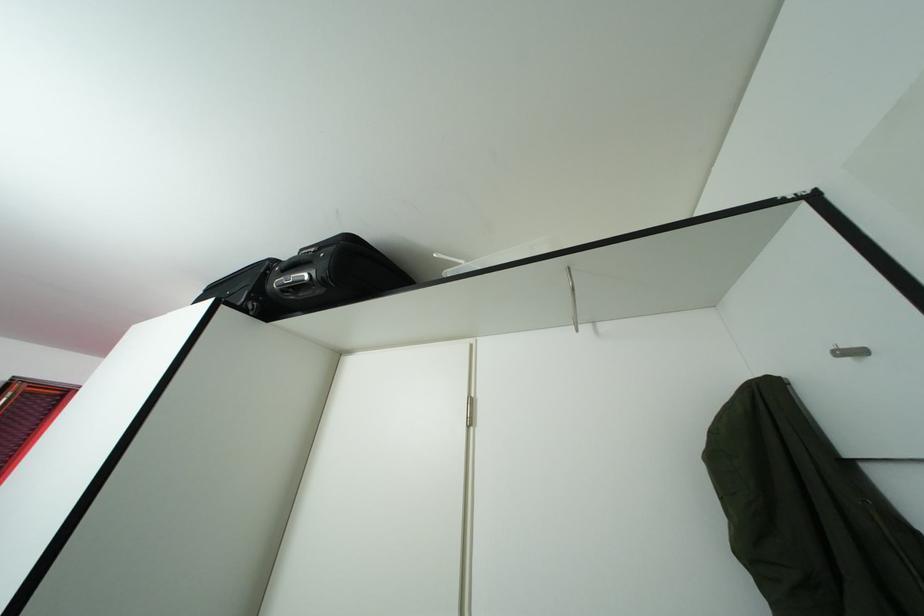
Describe the element at coordinates (573, 299) in the screenshot. I see `the metal hanging rod` at that location.